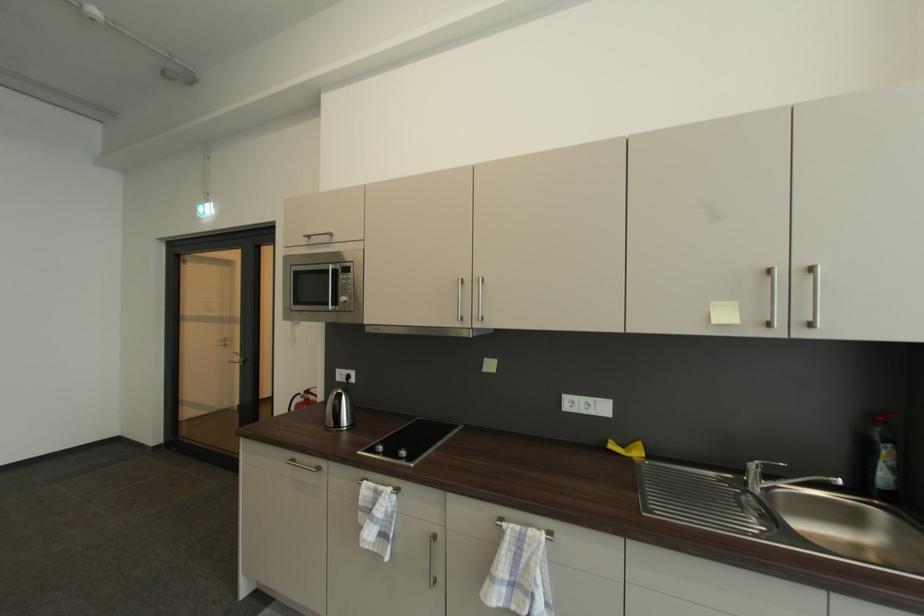
The location [302,399] corresponds to which object?

It refers to a red fire extinguisher.